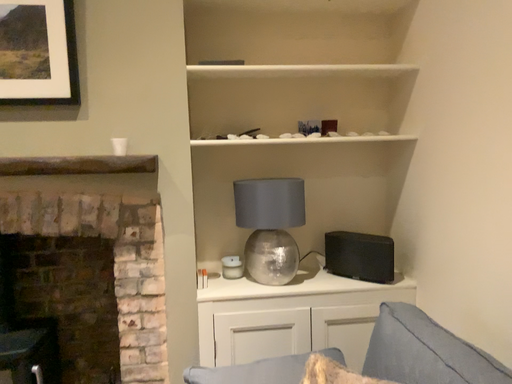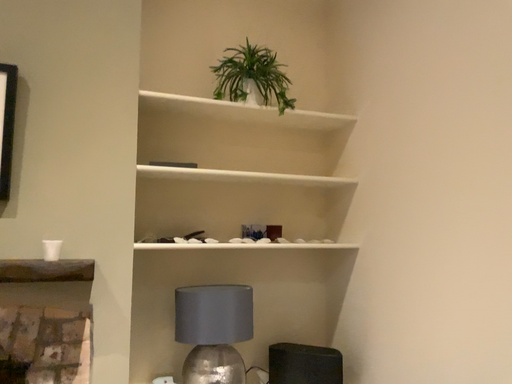
Question: Which way did the camera rotate in the video?

Choices:
 (A) rotated left
 (B) rotated right

Answer: (B)